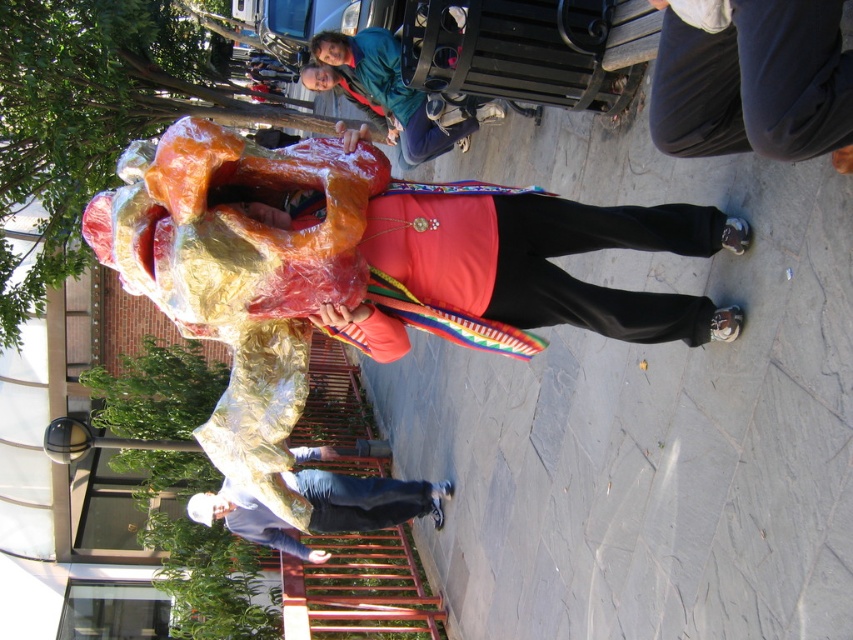
Based on the photo, between shiny metallic costume at center and shiny gold costume at center, which one has more height?

shiny gold costume at center

The height and width of the screenshot is (640, 853). In order to click on shiny metallic costume at center in this screenshot , I will do `click(526, 269)`.

Identify the location of shiny metallic costume at center. Image resolution: width=853 pixels, height=640 pixels. (526, 269).